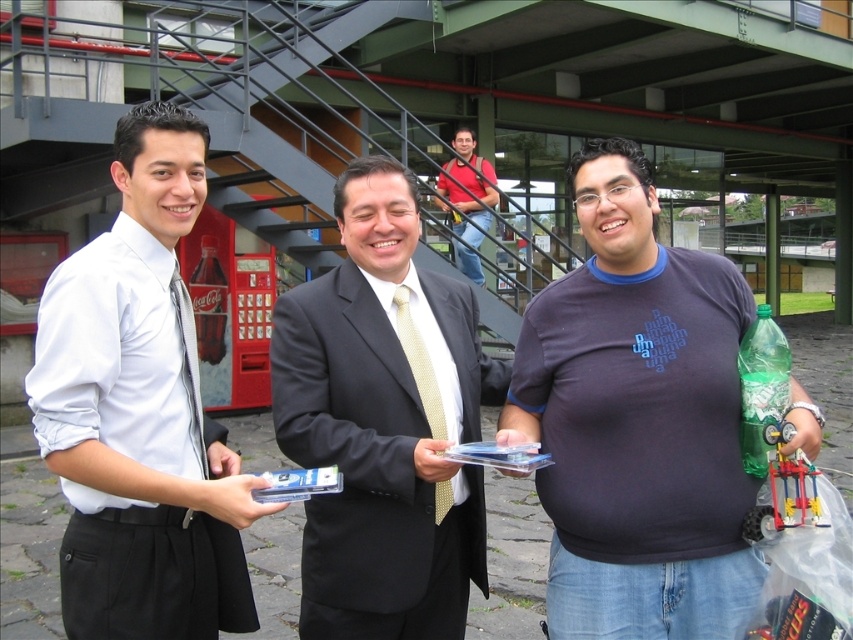
You are standing in front of the building and want to determine which of the two points, point [103,419] or point [450,160], is nearer to you. Based on the image, which point is closer?

Point [103,419] is closer to the viewer than point [450,160].